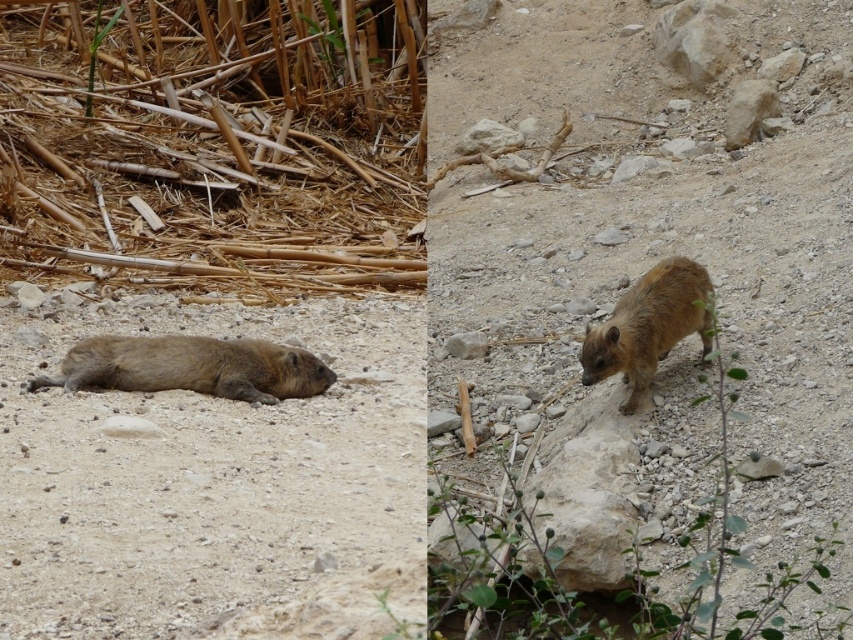
Question: Is brown furry hyrax at lower left positioned in front of brown furry hyrax at center?

Choices:
 (A) yes
 (B) no

Answer: (B)

Question: Which point appears farthest from the camera in this image?

Choices:
 (A) coord(260,390)
 (B) coord(668,316)

Answer: (A)

Question: Is brown furry hyrax at lower left positioned at the back of brown furry hyrax at center?

Choices:
 (A) yes
 (B) no

Answer: (A)

Question: Which point is closer to the camera?

Choices:
 (A) brown furry hyrax at lower left
 (B) brown furry hyrax at center

Answer: (B)

Question: Does brown furry hyrax at lower left appear over brown furry hyrax at center?

Choices:
 (A) no
 (B) yes

Answer: (A)